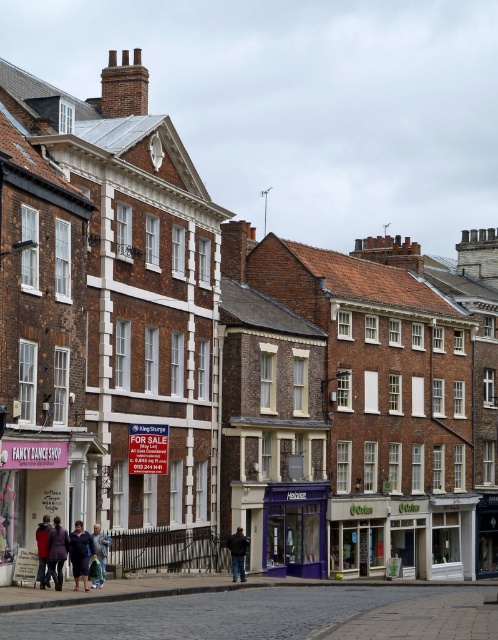
Does purple glass storefront at center have a larger size compared to black leather jacket at center?

Yes, purple glass storefront at center is bigger than black leather jacket at center.

Does point (320, 500) lie behind point (231, 536)?

Yes, it is.

Identify the location of purple glass storefront at center. The width and height of the screenshot is (498, 640). (294, 529).

This screenshot has height=640, width=498. In order to click on purple glass storefront at center in this screenshot , I will do click(294, 529).

Which of these two, pink fabric sign at center or blue denim jeans at lower left, stands shorter?

blue denim jeans at lower left

Which is below, pink fabric sign at center or blue denim jeans at lower left?

Positioned lower is blue denim jeans at lower left.

Between point (85, 481) and point (101, 568), which one is positioned in front?

Point (101, 568) is more forward.

Where is `pink fabric sign at center`? This screenshot has width=498, height=640. pink fabric sign at center is located at coordinates (43, 483).

Is black leather jacket at center closer to camera compared to blue denim jeans at lower left?

No, black leather jacket at center is behind blue denim jeans at lower left.

Is black leather jacket at center above blue denim jeans at lower left?

No.

Between point (240, 564) and point (104, 579), which one is positioned in front?

Positioned in front is point (104, 579).

In order to click on black leather jacket at center in this screenshot , I will do `click(238, 552)`.